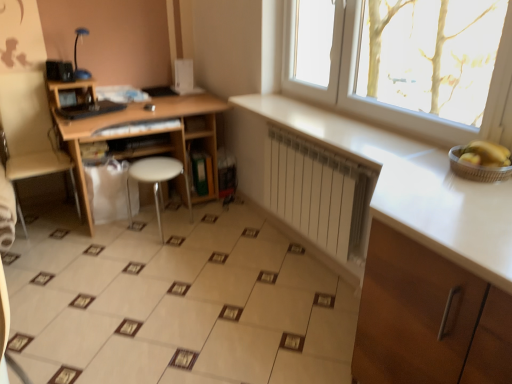
Where is `free spot above metallic silver basket at right (from a real-world perspective)`? The height and width of the screenshot is (384, 512). free spot above metallic silver basket at right (from a real-world perspective) is located at coordinates (476, 160).